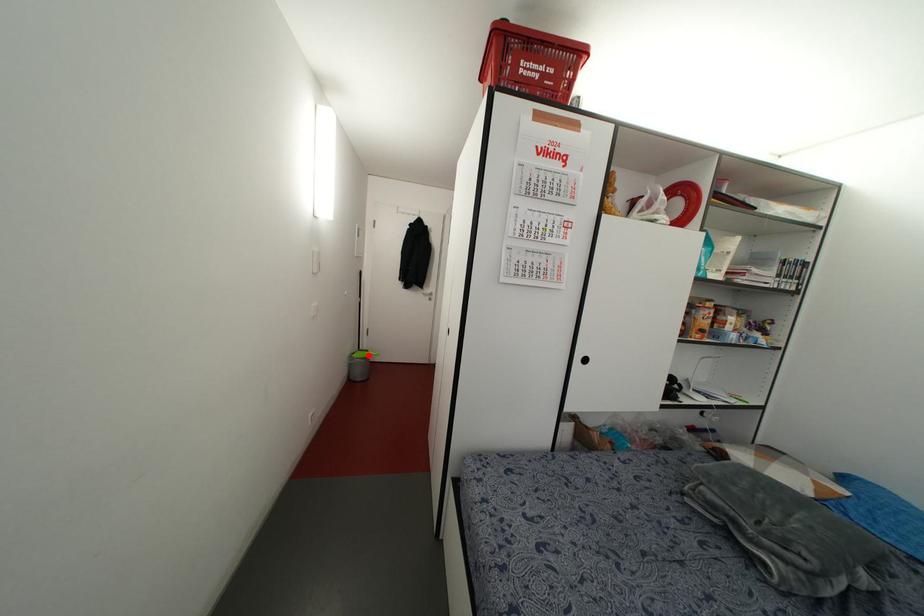
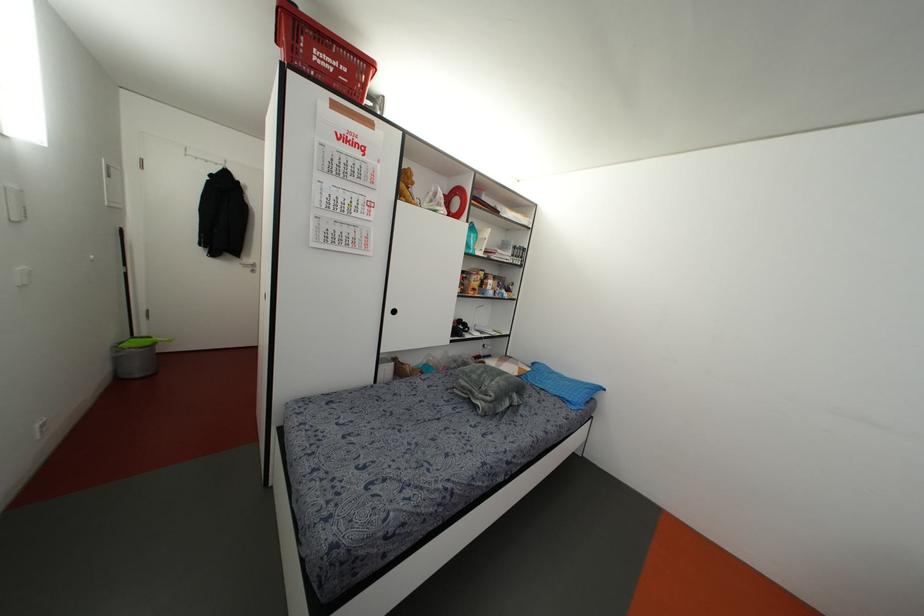
Question: I am providing you with two images of the same scene from different viewpoints. Image1 has a red point marked. In image2, the corresponding 3D location appears at what relative position? Reply with the corresponding letter.

Choices:
 (A) Closer
 (B) Farther

Answer: (B)